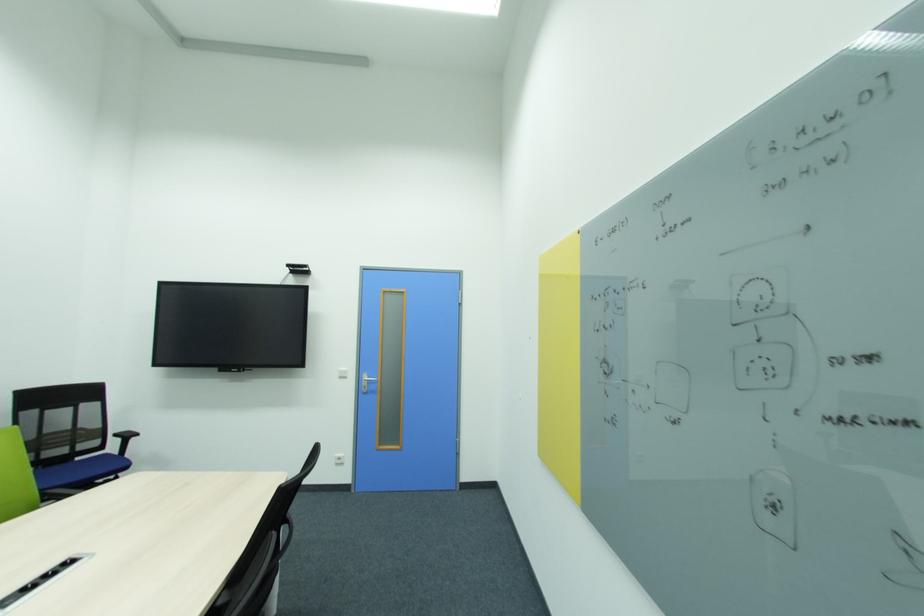
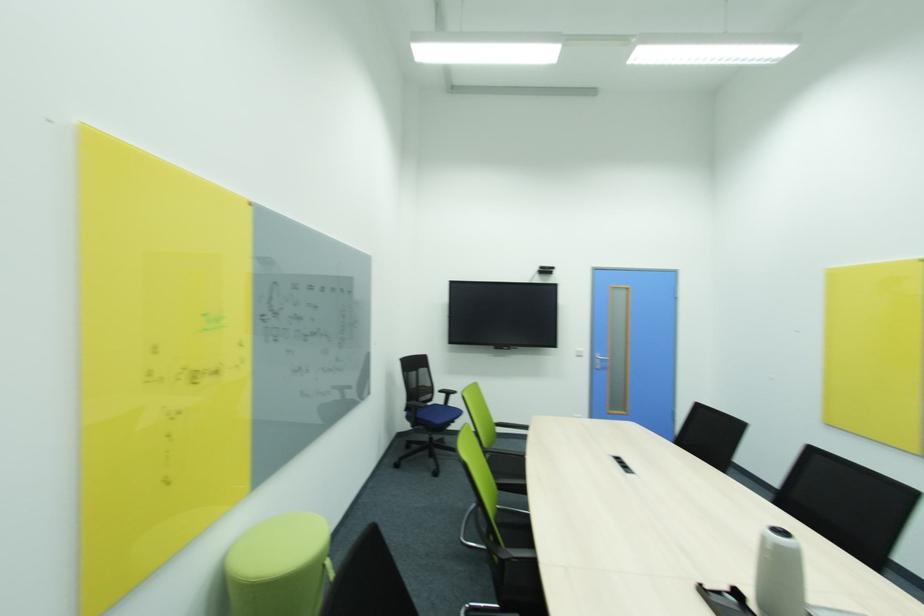
Locate, in the second image, the point that corresponds to [370,392] in the first image.

(602, 368)